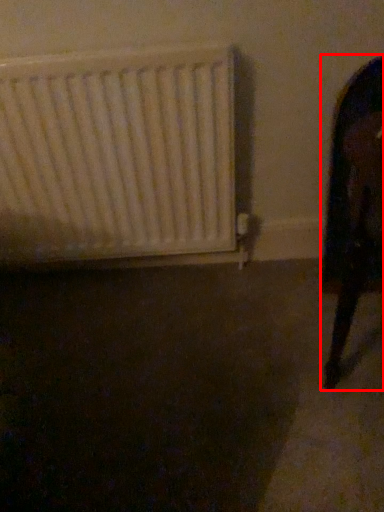
Question: From the image's perspective, what is the correct spatial relationship of furniture (annotated by the red box) in relation to radiator?

Choices:
 (A) below
 (B) above

Answer: (A)